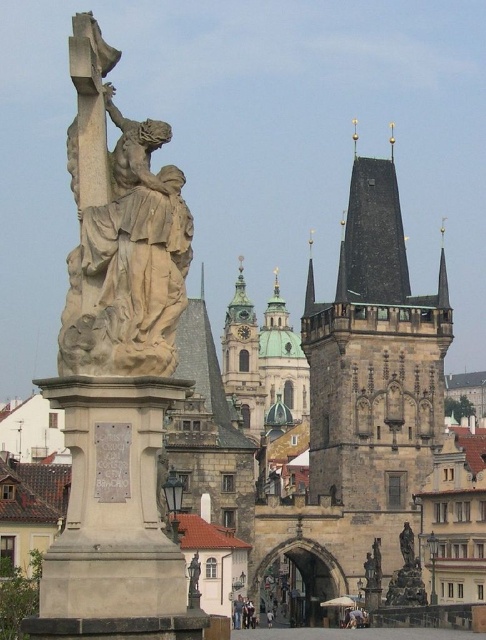
Is beige stone sculpture at center thinner than polished bronze statue at center?

Incorrect, beige stone sculpture at center's width is not less than polished bronze statue at center's.

Which is more to the left, beige stone sculpture at center or polished bronze statue at center?

beige stone sculpture at center

Between point (138, 321) and point (409, 528), which one is positioned in front?

Point (138, 321) is more forward.

Find the location of a particular element. beige stone sculpture at center is located at coordinates (122, 246).

Which is behind, point (356, 317) or point (412, 557)?

Point (356, 317)

Is polished stone tower at center right smaller than polished bronze statue at center?

Incorrect, polished stone tower at center right is not smaller in size than polished bronze statue at center.

The width and height of the screenshot is (486, 640). Find the location of `polished stone tower at center right`. polished stone tower at center right is located at coordinates (374, 356).

Does polished stone tower at center right have a greater height compared to beige stone sculpture at center?

Correct, polished stone tower at center right is much taller as beige stone sculpture at center.

Measure the distance between point (x=362, y=257) and camera.

A distance of 334.44 feet exists between point (x=362, y=257) and camera.

Does point (360, 483) come in front of point (89, 214)?

No, it is behind (89, 214).

The height and width of the screenshot is (640, 486). In order to click on polished stone tower at center right in this screenshot , I will do `click(374, 356)`.